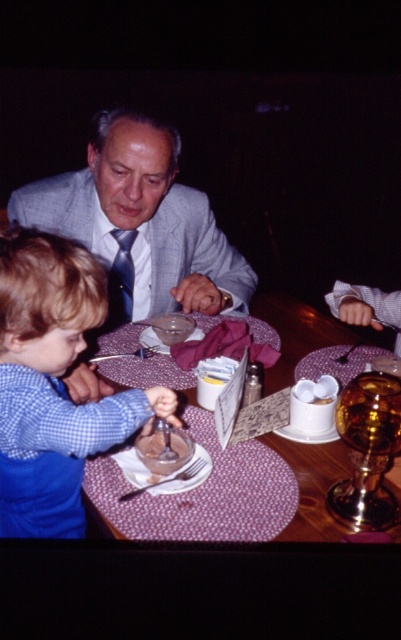
You are organizing a charity event and need to determine seating arrangements based on the space each attendee occupies. If you have two attendees wearing the blue checkered shirt at lower left and the gray suit at center, which attendee requires more space for seating?

The gray suit at center requires more space because the blue checkered shirt at lower left occupies less space than gray suit at center.